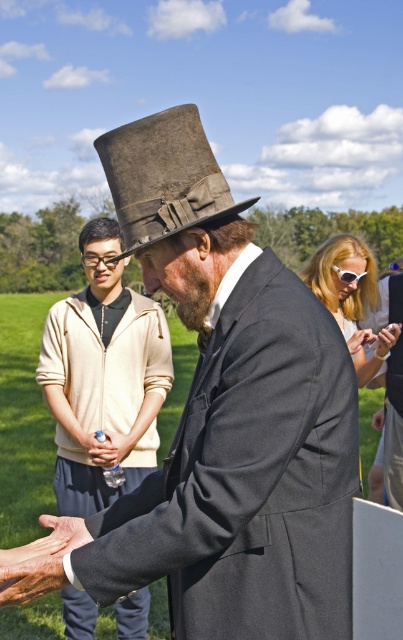
Image resolution: width=403 pixels, height=640 pixels. What do you see at coordinates (103, 387) in the screenshot? I see `light beige hoodie at center` at bounding box center [103, 387].

Can you confirm if light beige hoodie at center is positioned to the right of dark brown felt fedora at upper center?

Incorrect, light beige hoodie at center is not on the right side of dark brown felt fedora at upper center.

Is point (110, 240) positioned before point (234, 211)?

No, it is not.

Where is `light beige hoodie at center`? The width and height of the screenshot is (403, 640). light beige hoodie at center is located at coordinates (103, 387).

Does dark brown felt fedora at upper center have a greater height compared to smooth skin hand at center?

Correct, dark brown felt fedora at upper center is much taller as smooth skin hand at center.

Where is `dark brown felt fedora at upper center`? The width and height of the screenshot is (403, 640). dark brown felt fedora at upper center is located at coordinates (164, 177).

Between point (49, 576) and point (112, 257), which one is positioned behind?

Point (112, 257)

Between dry skin at lower left and black plastic goggles at center, which one is positioned higher?

black plastic goggles at center is above.

Who is more forward, (27, 560) or (89, 260)?

Point (27, 560)

Identify the location of dry skin at lower left. (31, 579).